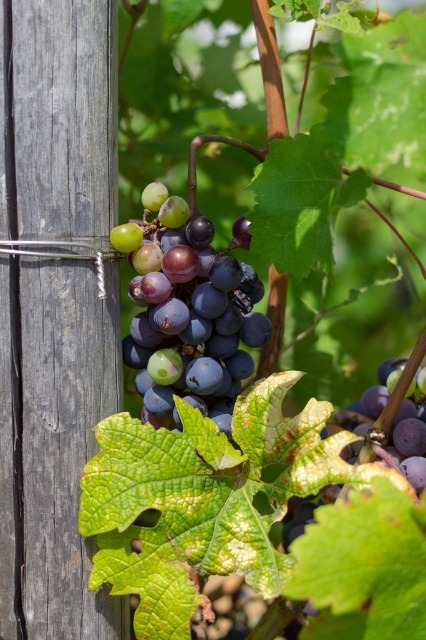
Which is more to the left, shiny purple grapes at center or purple matte grape at lower right?

shiny purple grapes at center

The height and width of the screenshot is (640, 426). What are the coordinates of `shiny purple grapes at center` in the screenshot? It's located at (187, 310).